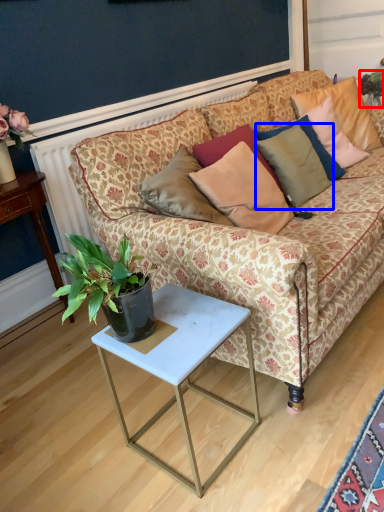
Question: Which point is further to the camera, houseplant (highlighted by a red box) or pillow (highlighted by a blue box)?

Choices:
 (A) houseplant
 (B) pillow

Answer: (A)